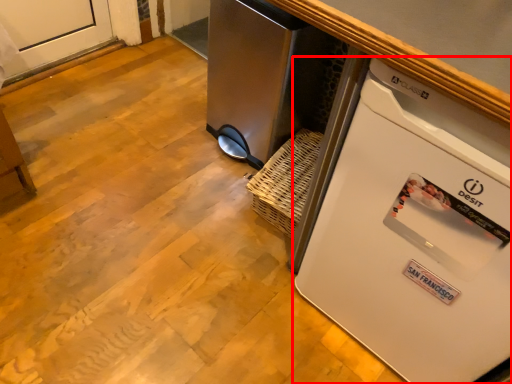
Question: In this image, where is home appliance (annotated by the red box) located relative to appliance?

Choices:
 (A) right
 (B) left

Answer: (A)